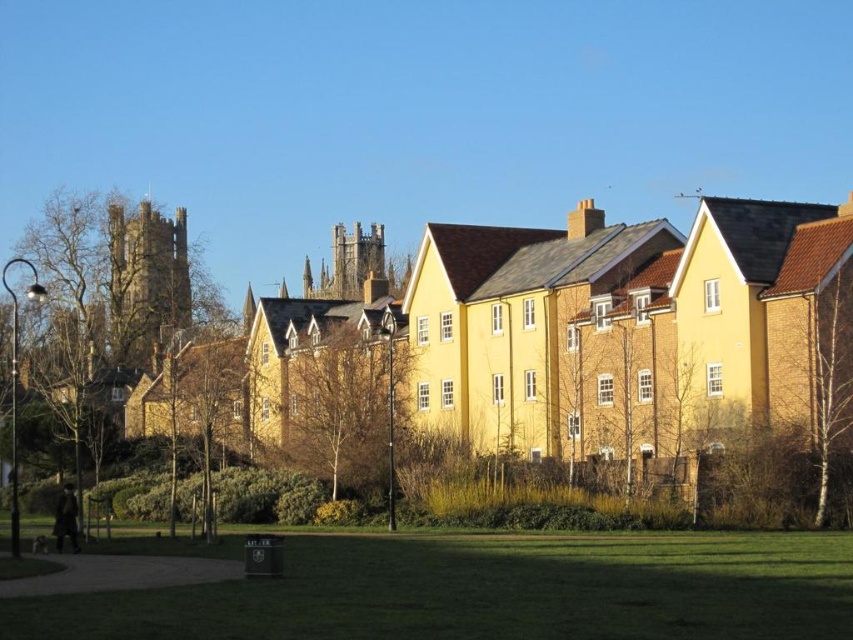
Question: Which object is farther from the camera taking this photo?

Choices:
 (A) brown textured tree at center
 (B) white textured tree at right
 (C) smooth brown tree at lower left

Answer: (A)

Question: Is brown textured tree at center to the left of white textured tree at right from the viewer's perspective?

Choices:
 (A) yes
 (B) no

Answer: (A)

Question: Is white textured tree at right bigger than smooth brown tree at lower left?

Choices:
 (A) yes
 (B) no

Answer: (B)

Question: Which point appears farthest from the camera in this image?

Choices:
 (A) (838, 280)
 (B) (387, 396)
 (C) (231, 376)

Answer: (C)

Question: Which object is the farthest from the smooth brown tree at lower left?

Choices:
 (A) white textured tree at right
 (B) brown textured tree at center

Answer: (A)

Question: Considering the relative positions of white textured tree at right and smooth brown tree at lower left in the image provided, where is white textured tree at right located with respect to smooth brown tree at lower left?

Choices:
 (A) left
 (B) right

Answer: (B)